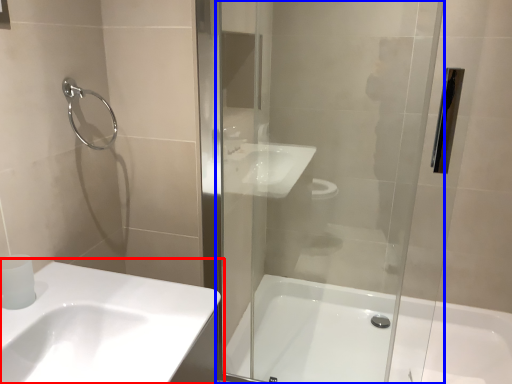
Question: Which of the following is the farthest to the observer, sink (highlighted by a red box) or screen door (highlighted by a blue box)?

Choices:
 (A) sink
 (B) screen door

Answer: (B)